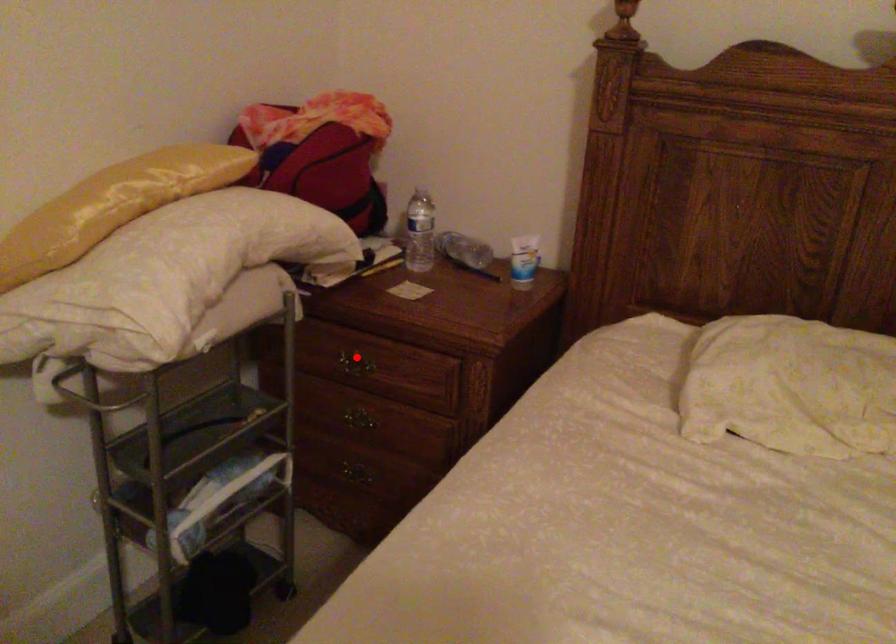
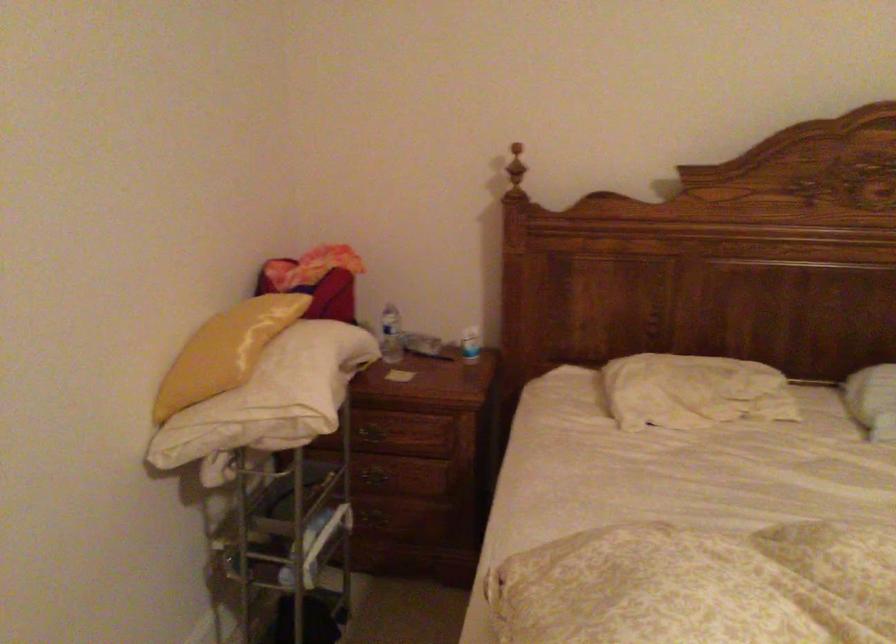
Question: I am providing you with two images of the same scene from different viewpoints. Given a red point in image1, look at the same physical point in image2. Is it:

Choices:
 (A) Closer to the viewpoint
 (B) Farther from the viewpoint

Answer: (B)